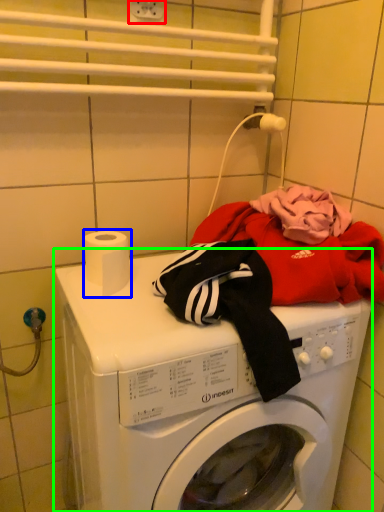
Question: Based on their relative distances, which object is nearer to electric outlet (highlighted by a red box)? Choose from toilet paper (highlighted by a blue box) and washing machine (highlighted by a green box).

Choices:
 (A) toilet paper
 (B) washing machine

Answer: (A)